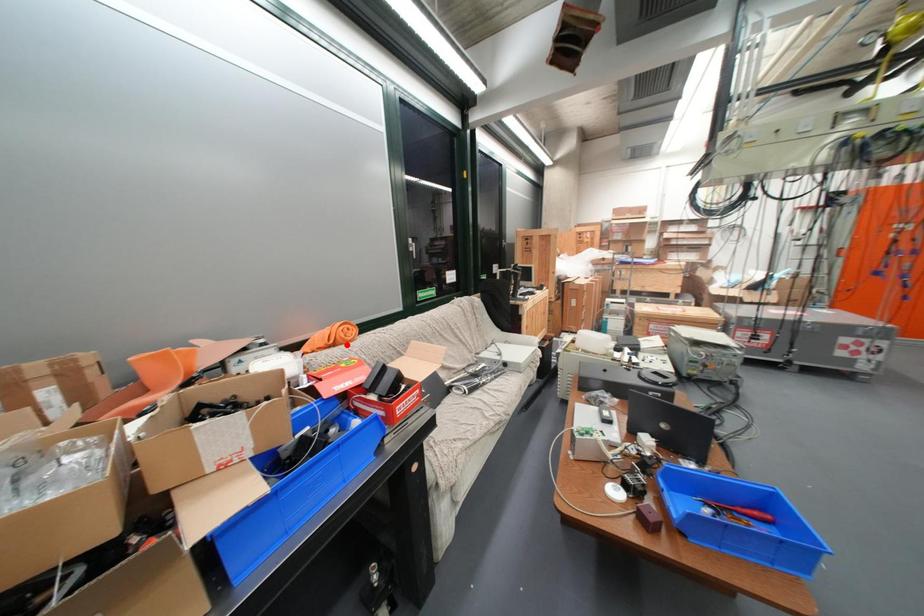
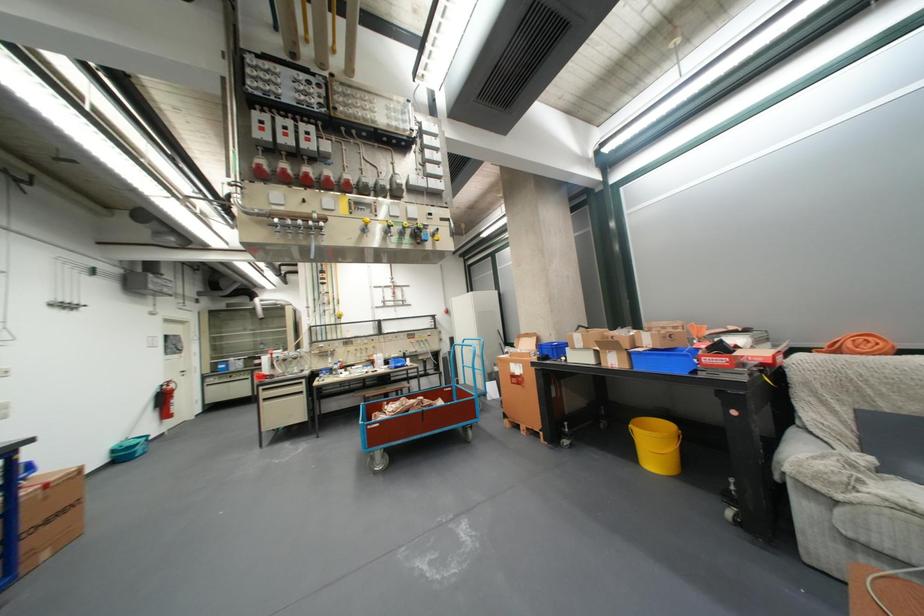
In the second image, find the point that corresponds to the highlighted location in the first image.

(849, 352)